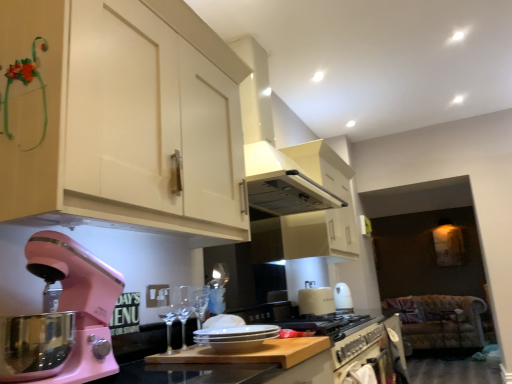
This screenshot has width=512, height=384. Describe the element at coordinates (356, 349) in the screenshot. I see `metallic silver oven at lower center` at that location.

The width and height of the screenshot is (512, 384). In order to click on pink matte stand mixer at lower left in this screenshot , I will do `click(79, 302)`.

Identify the location of smooth wooden cutting board at center. The width and height of the screenshot is (512, 384). (251, 353).

What do you see at coordinates (251, 353) in the screenshot?
I see `smooth wooden cutting board at center` at bounding box center [251, 353].

Image resolution: width=512 pixels, height=384 pixels. Describe the element at coordinates (122, 120) in the screenshot. I see `white matte cabinet at upper center, the second cabinetry when ordered from back to front` at that location.

The image size is (512, 384). I want to click on metallic silver oven at lower center, so click(x=356, y=349).

Which of these two, clear glass wine glass at center, positioned as the first wine glass in front-to-back order, or smooth wooden cutting board at center, is wider?

With larger width is smooth wooden cutting board at center.

Is the surface of clear glass wine glass at center, positioned as the first wine glass in front-to-back order, in direct contact with smooth wooden cutting board at center?

No, clear glass wine glass at center, positioned as the first wine glass in front-to-back order, is not making contact with smooth wooden cutting board at center.

Which object is more forward, clear glass wine glass at center, positioned as the first wine glass in front-to-back order, or smooth wooden cutting board at center?

Positioned in front is smooth wooden cutting board at center.

At what (x,y) coordinates should I click in order to perform the action: click on the 1st wine glass behind the smooth wooden cutting board at center, starting your count from the anchor. Please return your answer as a coordinate pair (x, y). The image size is (512, 384). Looking at the image, I should click on (168, 311).

Is white matte cabinet at upper center, the second cabinetry when ordered from back to front, at the back of white glossy exhaust hood at upper center?

No.

Does white glossy exhaust hood at upper center lie in front of white matte cabinet at upper center, marked as the first cabinetry in a front-to-back arrangement?

No, it is not.

Considering the relative sizes of white glossy exhaust hood at upper center and white matte cabinet at upper center, the second cabinetry when ordered from back to front, in the image provided, is white glossy exhaust hood at upper center shorter than white matte cabinet at upper center, the second cabinetry when ordered from back to front,?

No, white glossy exhaust hood at upper center is not shorter than white matte cabinet at upper center, the second cabinetry when ordered from back to front.

Is point (260, 198) positioned after point (241, 240)?

Yes, point (260, 198) is farther from viewer.

Would you say green matte decoration at upper left, positioned as the 2th cabinetry in front-to-back order, is outside metallic silver oven at lower center?

green matte decoration at upper left, positioned as the 2th cabinetry in front-to-back order, lies outside metallic silver oven at lower center's area.

How distant is green matte decoration at upper left, positioned as the 2th cabinetry in front-to-back order, from metallic silver oven at lower center?

green matte decoration at upper left, positioned as the 2th cabinetry in front-to-back order, is 4.98 feet away from metallic silver oven at lower center.

From the metallic silver oven at lower center, count the 2nd cabinetry to the left and point to it. Please provide its 2D coordinates.

[(30, 105)]

From a real-world perspective, is green matte decoration at upper left, marked as the first cabinetry in a back-to-front arrangement, on top of metallic silver oven at lower center?

Correct, in the physical world, green matte decoration at upper left, marked as the first cabinetry in a back-to-front arrangement, is higher than metallic silver oven at lower center.

Who is taller, white glossy exhaust hood at upper center or green matte decoration at upper left, positioned as the 2th cabinetry in front-to-back order?

With more height is white glossy exhaust hood at upper center.

Who is bigger, white glossy exhaust hood at upper center or green matte decoration at upper left, positioned as the 2th cabinetry in front-to-back order?

Bigger between the two is white glossy exhaust hood at upper center.

Is point (264, 149) closer or farther from the camera than point (11, 119)?

Point (264, 149) is farther from the camera than point (11, 119).

Who is taller, white glossy exhaust hood at upper center or clear glass wine glass at center, which is the second wine glass in back-to-front order?

With more height is white glossy exhaust hood at upper center.

Can you see white glossy exhaust hood at upper center touching clear glass wine glass at center, which is the second wine glass in back-to-front order?

No, white glossy exhaust hood at upper center is not with clear glass wine glass at center, which is the second wine glass in back-to-front order.

Which point is more forward, (264, 131) or (167, 328)?

The point (167, 328) is closer.

Can you confirm if white glossy exhaust hood at upper center is bigger than clear glass wine glass at center, which is the second wine glass in back-to-front order?

Yes, white glossy exhaust hood at upper center is bigger than clear glass wine glass at center, which is the second wine glass in back-to-front order.

Is smooth wooden cutting board at center taller than white glossy plates at center?

No.

Where is `appliance that appears on the left of smooth wooden cutting board at center`? appliance that appears on the left of smooth wooden cutting board at center is located at coordinates (236, 337).

Is smooth wooden cutting board at center thinner than white glossy plates at center?

No, smooth wooden cutting board at center is not thinner than white glossy plates at center.

From the image's perspective, would you say smooth wooden cutting board at center is shown under white glossy plates at center?

Yes, from the image's perspective, smooth wooden cutting board at center is below white glossy plates at center.

Which of these two, white glossy plates at center or velvet floral-patterned sofa at lower right, is thinner?

white glossy plates at center is thinner.

Is white glossy plates at center turned away from velvet floral-patterned sofa at lower right?

white glossy plates at center does not have its back to velvet floral-patterned sofa at lower right.

Where is `sit on the right side of white glossy plates at center`? sit on the right side of white glossy plates at center is located at coordinates [440, 320].

Which wine glass is the 1st one when counting from the back of the smooth wooden cutting board at center? Please provide its 2D coordinates.

[(168, 311)]

At what (x,y) coordinates should I click in order to perform the action: click on the 1st cabinetry below the white glossy exhaust hood at upper center (from the image's perspective). Please return your answer as a coordinate pair (x, y). Looking at the image, I should click on (122, 120).

Estimate the real-world distances between objects in this image. Which object is further from white glossy exhaust hood at upper center, velvet floral-patterned sofa at lower right or clear glass wine glass at center, marked as the 1th wine glass in a back-to-front arrangement?

Based on the image, velvet floral-patterned sofa at lower right appears to be further to white glossy exhaust hood at upper center.

When comparing their distances from clear glass wine glass at center, positioned as the first wine glass in front-to-back order, does clear glass wine glass at center, which ranks as the second wine glass in front-to-back order, or white glossy exhaust hood at upper center seem further?

white glossy exhaust hood at upper center is further to clear glass wine glass at center, positioned as the first wine glass in front-to-back order.

When comparing their distances from white glossy plates at center, does white matte cabinet at upper center, marked as the first cabinetry in a front-to-back arrangement, or smooth wooden cutting board at center seem further?

Based on the image, white matte cabinet at upper center, marked as the first cabinetry in a front-to-back arrangement, appears to be further to white glossy plates at center.

Based on their spatial positions, is white glossy plates at center or pink matte stand mixer at lower left closer to white matte cabinet at upper center, marked as the first cabinetry in a front-to-back arrangement?

Among the two, pink matte stand mixer at lower left is located nearer to white matte cabinet at upper center, marked as the first cabinetry in a front-to-back arrangement.

Based on the photo, when comparing their distances from smooth wooden cutting board at center, does clear glass wine glass at center, marked as the 1th wine glass in a back-to-front arrangement, or metallic silver oven at lower center seem further?

metallic silver oven at lower center is further to smooth wooden cutting board at center.

Which object lies further to the anchor point green matte decoration at upper left, marked as the first cabinetry in a back-to-front arrangement, clear glass wine glass at center, marked as the 1th wine glass in a back-to-front arrangement, or white glossy plates at center?

Among the two, clear glass wine glass at center, marked as the 1th wine glass in a back-to-front arrangement, is located further to green matte decoration at upper left, marked as the first cabinetry in a back-to-front arrangement.

When comparing their distances from metallic silver oven at lower center, does white glossy plates at center or velvet floral-patterned sofa at lower right seem further?

velvet floral-patterned sofa at lower right is positioned further to the anchor metallic silver oven at lower center.

Which object lies further to the anchor point pink matte stand mixer at lower left, white glossy exhaust hood at upper center or clear glass wine glass at center, which ranks as the second wine glass in front-to-back order?

Based on the image, white glossy exhaust hood at upper center appears to be further to pink matte stand mixer at lower left.

Where is `appliance between pink matte stand mixer at lower left and clear glass wine glass at center, which is the second wine glass in back-to-front order, from front to back`? This screenshot has height=384, width=512. appliance between pink matte stand mixer at lower left and clear glass wine glass at center, which is the second wine glass in back-to-front order, from front to back is located at coordinates (236, 337).

At what (x,y) coordinates should I click in order to perform the action: click on exhaust hood between smooth wooden cutting board at center and velvet floral-patterned sofa at lower right in the front-back direction. Please return your answer as a coordinate pair (x, y). The width and height of the screenshot is (512, 384). Looking at the image, I should click on (272, 147).

This screenshot has height=384, width=512. Identify the location of wine glass that lies between white glossy exhaust hood at upper center and clear glass wine glass at center, which ranks as the second wine glass in front-to-back order, from top to bottom. (168, 311).

This screenshot has width=512, height=384. I want to click on countertop located between pink matte stand mixer at lower left and white glossy exhaust hood at upper center in the depth direction, so click(251, 353).